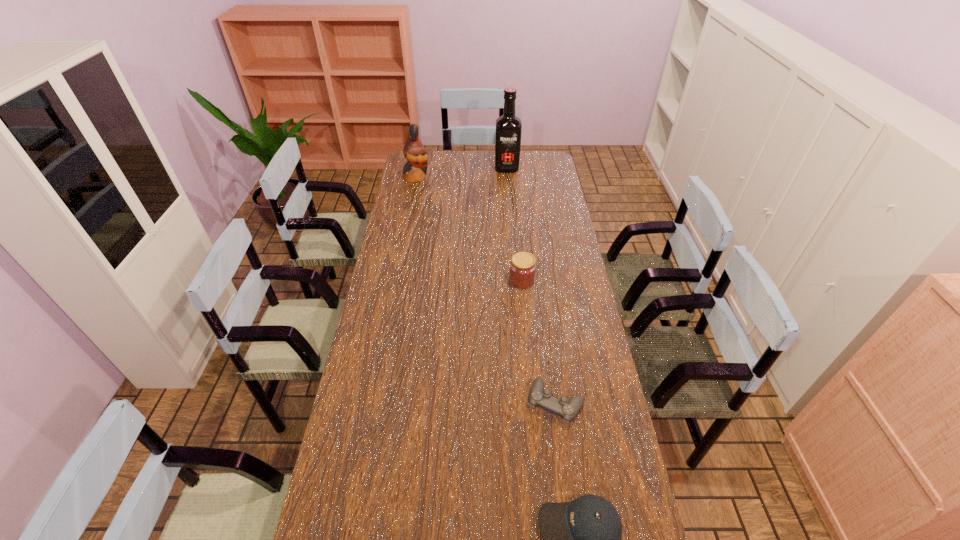
Where is `free spot between the second tallest object and the third shortest object`? Image resolution: width=960 pixels, height=540 pixels. free spot between the second tallest object and the third shortest object is located at coordinates (468, 229).

This screenshot has height=540, width=960. Identify the location of free spot between the shortest object and the leftmost object. (486, 290).

This screenshot has height=540, width=960. Find the location of `free point between the liquor and the third tallest object`. free point between the liquor and the third tallest object is located at coordinates (515, 225).

Choose which object is the second nearest neighbor to the third nearest object. Please provide its 2D coordinates. Your answer should be formatted as a tuple, i.e. [(x, y)], where the tuple contains the x and y coordinates of a point satisfying the conditions above.

[(508, 130)]

Find the location of `the fourth closest object relative to the leftmost object`. the fourth closest object relative to the leftmost object is located at coordinates (582, 538).

This screenshot has height=540, width=960. Find the location of `vacant space that satisfies the following two spatial constraints: 1. on the face of the jam; 2. on the left side of the parrot`. vacant space that satisfies the following two spatial constraints: 1. on the face of the jam; 2. on the left side of the parrot is located at coordinates (396, 281).

At what (x,y) coordinates should I click in order to perform the action: click on vacant area in the image that satisfies the following two spatial constraints: 1. on the front-facing side of the shortest object; 2. on the right side of the liquor. Please return your answer as a coordinate pair (x, y). Looking at the image, I should click on (526, 403).

The image size is (960, 540). What are the coordinates of `free space that satisfies the following two spatial constraints: 1. on the front-facing side of the liquor; 2. on the right side of the jam` in the screenshot? It's located at (516, 281).

At what (x,y) coordinates should I click in order to perform the action: click on free location that satisfies the following two spatial constraints: 1. on the front-facing side of the third shortest object; 2. on the left side of the liquor. Please return your answer as a coordinate pair (x, y). Looking at the image, I should click on (516, 281).

You are a GUI agent. You are given a task and a screenshot of the screen. Output one action in this format:
    pyautogui.click(x=<x>, y=<y>)
    Task: Click on the free spot that satisfies the following two spatial constraints: 1. on the front side of the control; 2. on the left side of the jam
    
    Given the screenshot: What is the action you would take?
    pyautogui.click(x=534, y=403)